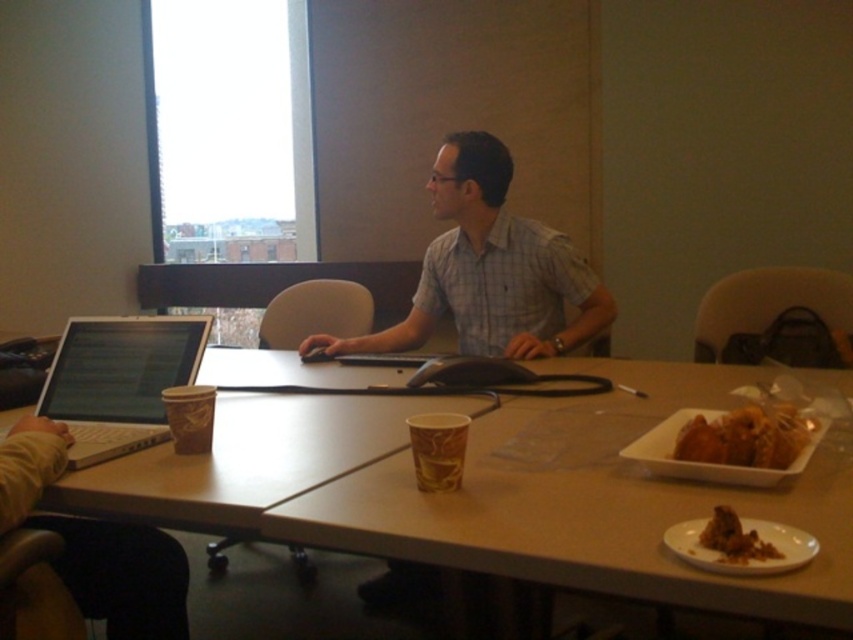
Which is above, silver metallic laptop at left or brown crumbly at lower right?

Positioned higher is silver metallic laptop at left.

Which is in front, point (161, 378) or point (744, 563)?

Point (744, 563) is in front.

Image resolution: width=853 pixels, height=640 pixels. In order to click on silver metallic laptop at left in this screenshot , I will do pyautogui.click(x=119, y=380).

Can you confirm if silver metallic laptop at left is positioned to the right of golden crispy chicken at right?

No, silver metallic laptop at left is not to the right of golden crispy chicken at right.

Who is shorter, silver metallic laptop at left or golden crispy chicken at right?

golden crispy chicken at right is shorter.

Between point (55, 412) and point (718, 429), which one is positioned in front?

Point (718, 429) is in front.

Locate an element on the screen. This screenshot has width=853, height=640. silver metallic laptop at left is located at coordinates (x=119, y=380).

Does point (434, 285) come closer to viewer compared to point (107, 380)?

No, (434, 285) is behind (107, 380).

Is point (480, 177) farther from camera compared to point (120, 403)?

Yes.

Does point (561, 259) come in front of point (170, 342)?

No, (561, 259) is further to viewer.

At what (x,y) coordinates should I click in order to perform the action: click on gray checkered shirt at center. Please return your answer as a coordinate pair (x, y). Image resolution: width=853 pixels, height=640 pixels. Looking at the image, I should click on (489, 269).